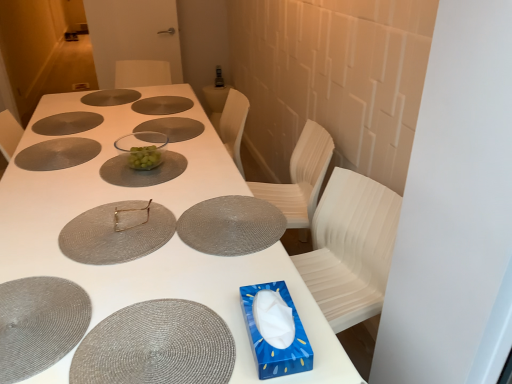
Identify the location of unoccupied space behind matte gray placemat at lower center, the first glass plate in the front-to-back sequence. (186, 265).